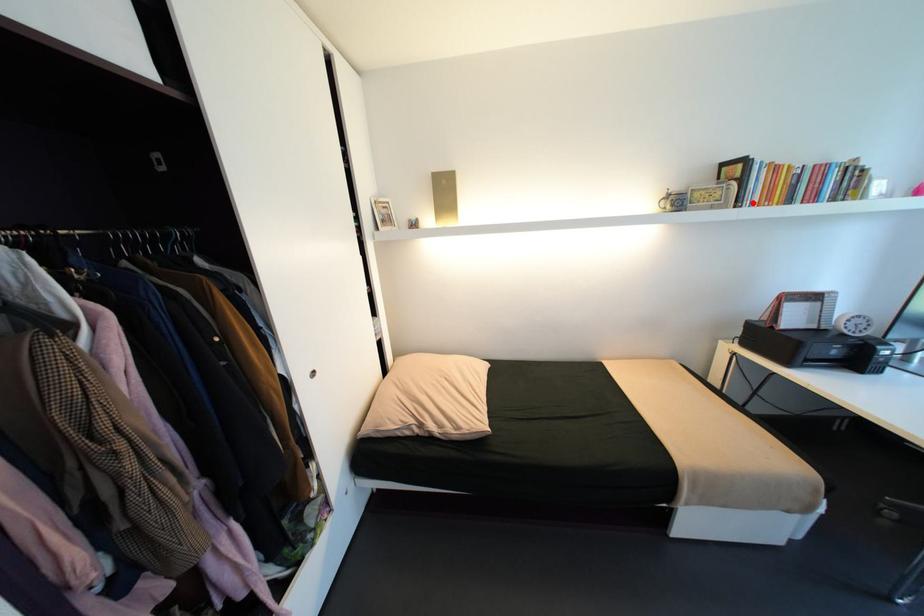
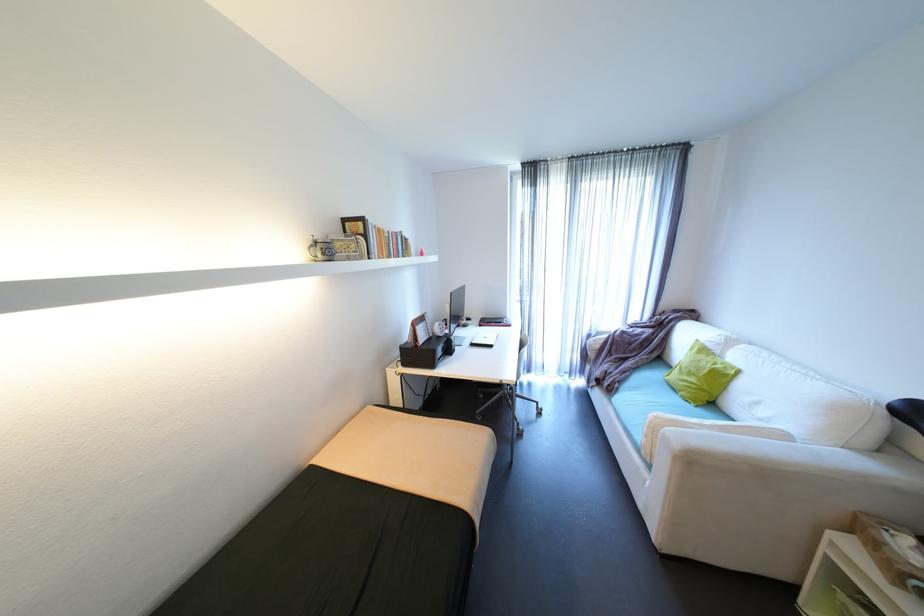
Where in the second image is the point corresponding to the highlighted location from the first image?

(380, 254)